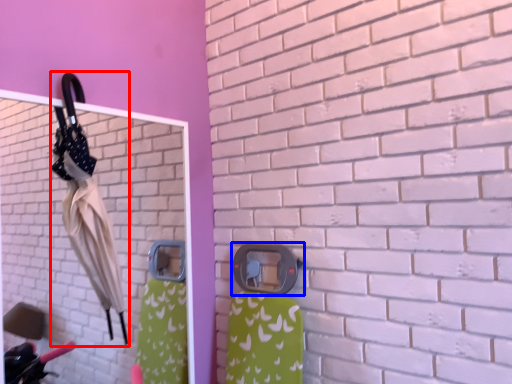
Question: Which object is closer to the camera taking this photo, umbrella (highlighted by a red box) or door handle (highlighted by a blue box)?

Choices:
 (A) umbrella
 (B) door handle

Answer: (A)